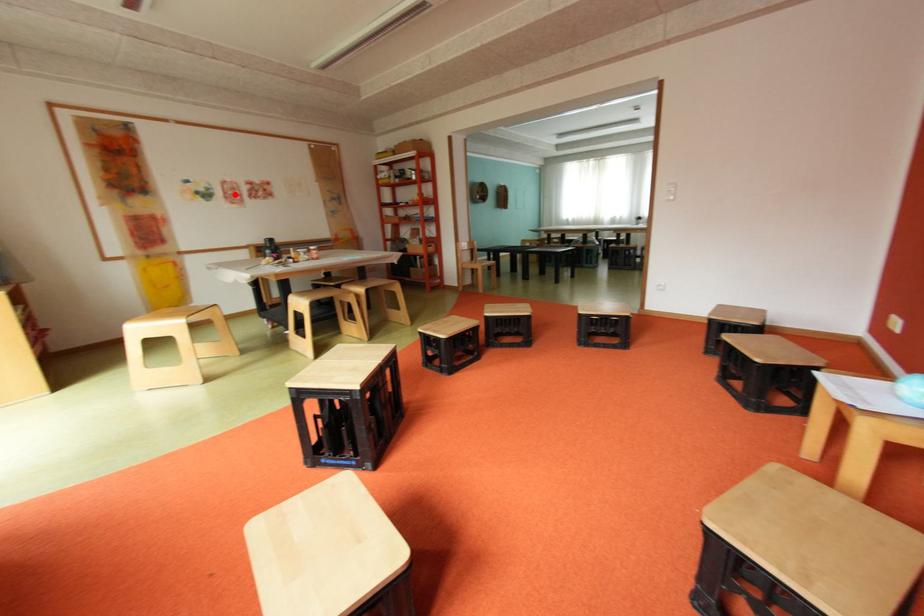
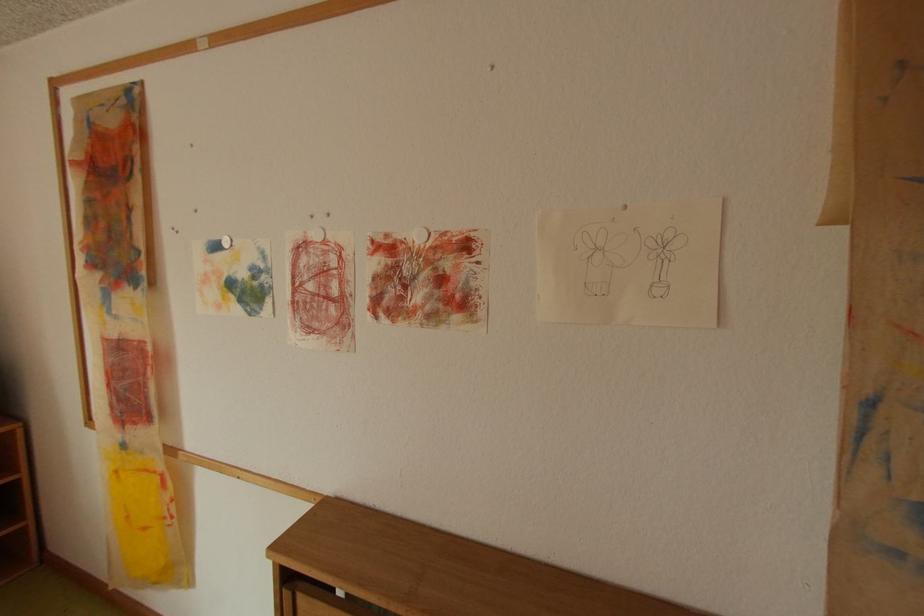
In the second image, find the point that corresponds to the highlighted location in the first image.

(304, 292)